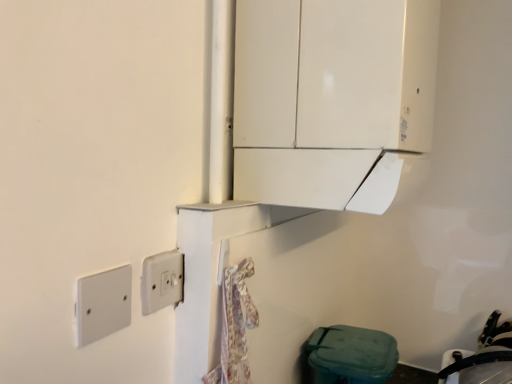
Question: Considering the positions of white plastic light switch at center, which ranks as the first light switch in back-to-front order, and black rubber sink at lower right in the image, is white plastic light switch at center, which ranks as the first light switch in back-to-front order, wider or thinner than black rubber sink at lower right?

Choices:
 (A) wide
 (B) thin

Answer: (B)

Question: Is white plastic light switch at center, the first light switch in the right-to-left sequence, bigger or smaller than black rubber sink at lower right?

Choices:
 (A) big
 (B) small

Answer: (B)

Question: Estimate the real-world distances between objects in this image. Which object is closer to the white plastic/light switch at lower left, positioned as the second light switch in back-to-front order?

Choices:
 (A) black rubber sink at lower right
 (B) white glossy cabinet at upper center
 (C) white plastic light switch at center, which is the 2th light switch from front to back

Answer: (C)

Question: Estimate the real-world distances between objects in this image. Which object is closer to the white glossy cabinet at upper center?

Choices:
 (A) white plastic light switch at center, acting as the second light switch starting from the left
 (B) white plastic/light switch at lower left, which ranks as the 1th light switch in front-to-back order
 (C) black rubber sink at lower right

Answer: (A)